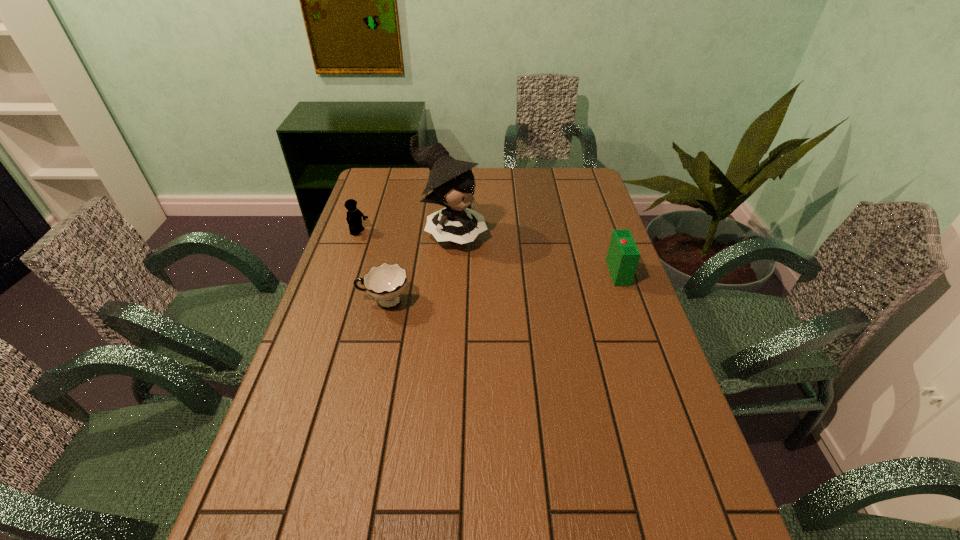
Identify the location of free space at the near left corner of the desktop. The image size is (960, 540). (329, 488).

In the image, there is a desktop. Where is `free space at the far right corner`? Image resolution: width=960 pixels, height=540 pixels. free space at the far right corner is located at coordinates (561, 187).

Where is `vacant space at the near right corner`? The width and height of the screenshot is (960, 540). vacant space at the near right corner is located at coordinates (642, 501).

Find the location of `free space between the doll and the shortest object`. free space between the doll and the shortest object is located at coordinates (418, 268).

At what (x,y) coordinates should I click in order to perform the action: click on vacant point located between the alarm clock and the cup. Please return your answer as a coordinate pair (x, y). The height and width of the screenshot is (540, 960). Looking at the image, I should click on (501, 287).

Identify the location of free spot between the Lego and the doll. The image size is (960, 540). (405, 234).

Find the location of a particular element. This screenshot has height=540, width=960. free space between the doll and the cup is located at coordinates (418, 268).

Where is `vacant space that is in between the tallest object and the cup`? vacant space that is in between the tallest object and the cup is located at coordinates (418, 268).

This screenshot has width=960, height=540. I want to click on free space between the alarm clock and the doll, so click(x=535, y=253).

Locate an element on the screen. The width and height of the screenshot is (960, 540). free space between the leftmost object and the tallest object is located at coordinates (405, 234).